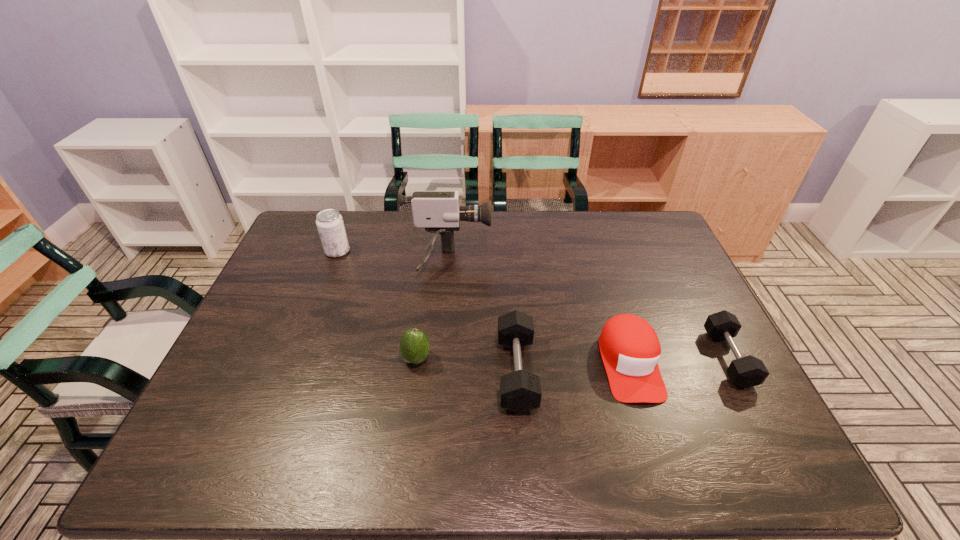
The width and height of the screenshot is (960, 540). What are the coordinates of `object that is the closest to the shorter dumbbell` in the screenshot? It's located at (630, 349).

Image resolution: width=960 pixels, height=540 pixels. In order to click on vacant area in the image that satisfies the following two spatial constraints: 1. on the recording direction of the shortest object; 2. on the right side of the camcorder in this screenshot , I will do `click(440, 358)`.

At what (x,y) coordinates should I click in order to perform the action: click on free space that satisfies the following two spatial constraints: 1. on the recording direction of the tallest object; 2. on the left side of the left dumbbell. Please return your answer as a coordinate pair (x, y). This screenshot has width=960, height=540. Looking at the image, I should click on (439, 372).

Find the location of a particular element. The image size is (960, 540). vacant space that satisfies the following two spatial constraints: 1. on the recording direction of the tallest object; 2. on the back side of the left dumbbell is located at coordinates (439, 372).